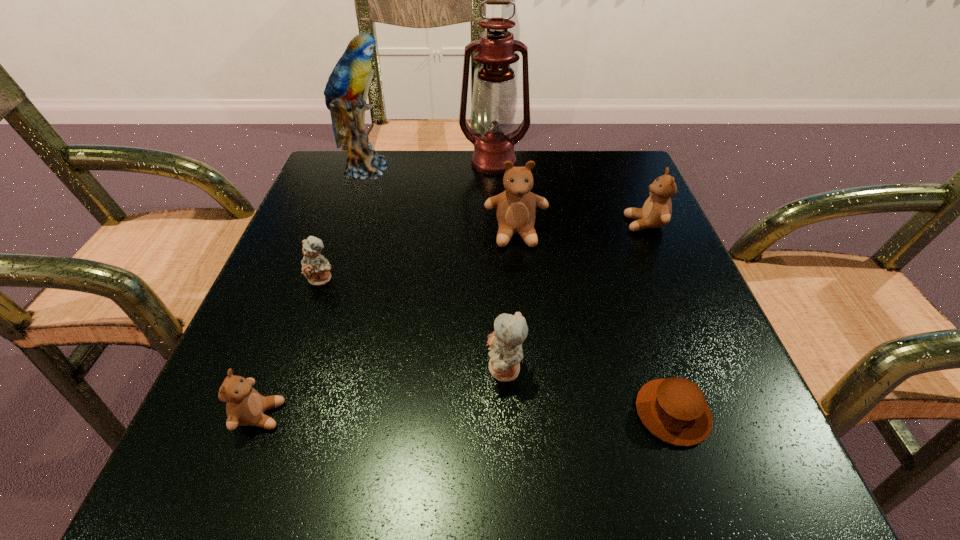
Where is `parrot that is at the left edge`? This screenshot has height=540, width=960. parrot that is at the left edge is located at coordinates (349, 77).

Find the location of a particular element. This screenshot has height=540, width=960. teddy bear that is positioned at the right edge is located at coordinates (656, 212).

At what (x,y) coordinates should I click in order to perform the action: click on muffin that is at the right edge. Please return your answer as a coordinate pair (x, y). Image resolution: width=960 pixels, height=540 pixels. Looking at the image, I should click on (675, 410).

At what (x,y) coordinates should I click in order to perform the action: click on object that is at the far left corner. Please return your answer as a coordinate pair (x, y). This screenshot has width=960, height=540. Looking at the image, I should click on (349, 77).

Identify the location of object that is positioned at the near left corner. The height and width of the screenshot is (540, 960). (245, 406).

What are the coordinates of `object that is at the near right corner` in the screenshot? It's located at (675, 410).

Identify the location of vacant space at the far edge of the desktop. (445, 153).

You are a GUI agent. You are given a task and a screenshot of the screen. Output one action in this format:
    pyautogui.click(x=<x>, y=<y>)
    Task: Click on the free region at the near edge of the desktop
    This screenshot has height=540, width=960.
    Given the screenshot: What is the action you would take?
    pyautogui.click(x=645, y=481)

Where is `vacant area at the left edge`? The image size is (960, 540). vacant area at the left edge is located at coordinates (333, 249).

Find the location of a particular element. This screenshot has width=960, height=540. free space at the right edge is located at coordinates (660, 311).